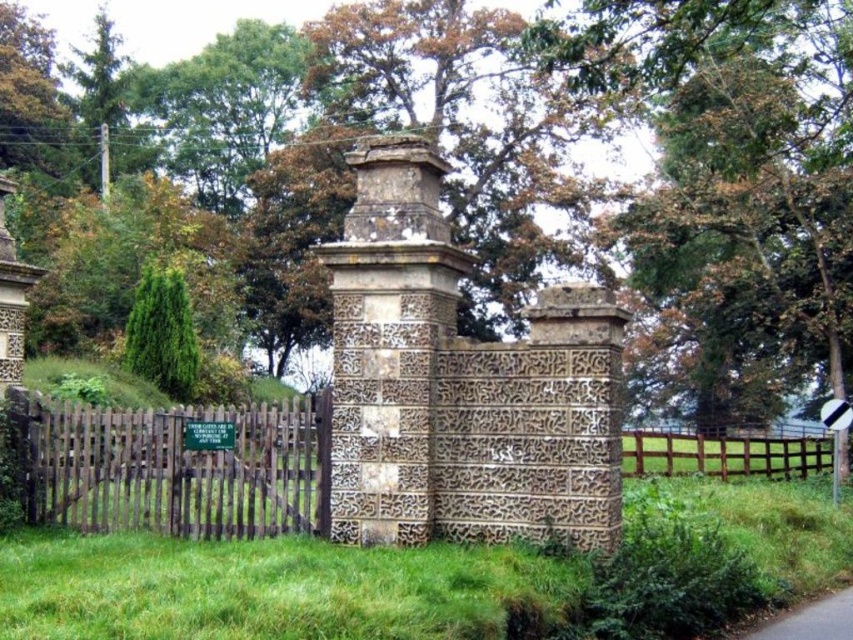
Is carved stone pillar at center taller than gray asphalt road at lower right?

Correct, carved stone pillar at center is much taller as gray asphalt road at lower right.

Which of these two, carved stone pillar at center or gray asphalt road at lower right, stands shorter?

With less height is gray asphalt road at lower right.

Between point (381, 444) and point (808, 621), which one is positioned in front?

Point (381, 444) is in front.

Find the location of a particular element. carved stone pillar at center is located at coordinates (387, 340).

Measure the distance between brown wooden fence at left and green leafy tree at upper center.

144.48 feet

Is brown wooden fence at left taller than green leafy tree at upper center?

No.

Who is more distant from viewer, [292,444] or [228,212]?

The point [228,212] is behind.

This screenshot has width=853, height=640. Identify the location of brown wooden fence at left. (177, 467).

Who is positioned more to the right, brown wooden fence at left or gray asphalt road at lower right?

gray asphalt road at lower right is more to the right.

Which is in front, point (190, 461) or point (819, 608)?

Point (819, 608) is in front.

The image size is (853, 640). Find the location of `brown wooden fence at left`. brown wooden fence at left is located at coordinates (177, 467).